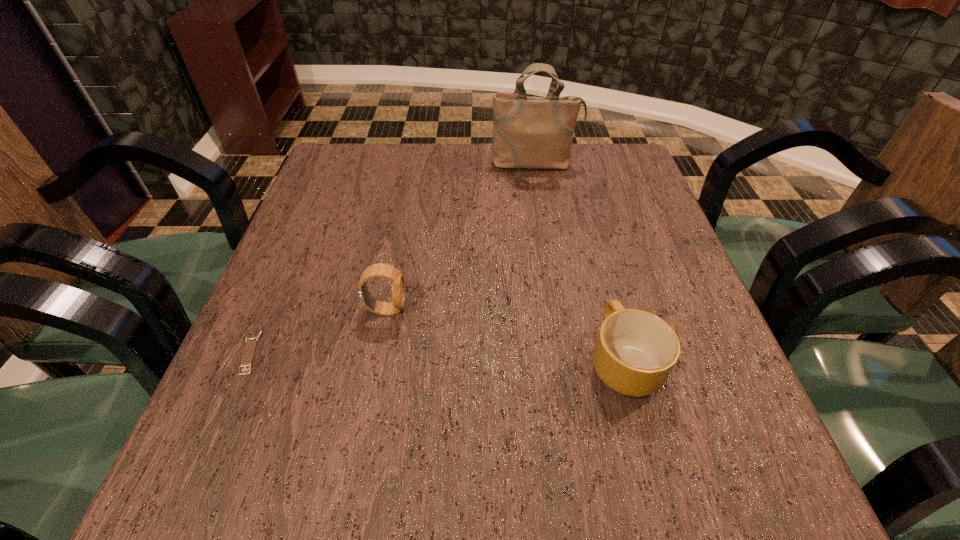
You are a GUI agent. You are given a task and a screenshot of the screen. Output one action in this format:
    pyautogui.click(x=<x>, y=<y>)
    Task: Click on the free space that satisfies the following two spatial constraints: 1. on the face of the taller watch; 2. on the side with the handle of the second shortest object
    
    Given the screenshot: What is the action you would take?
    click(376, 361)